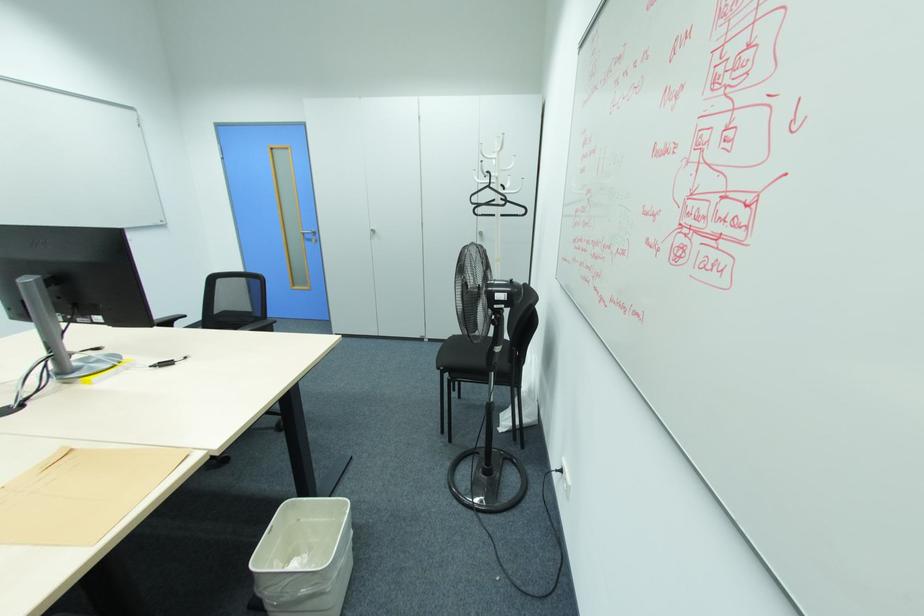
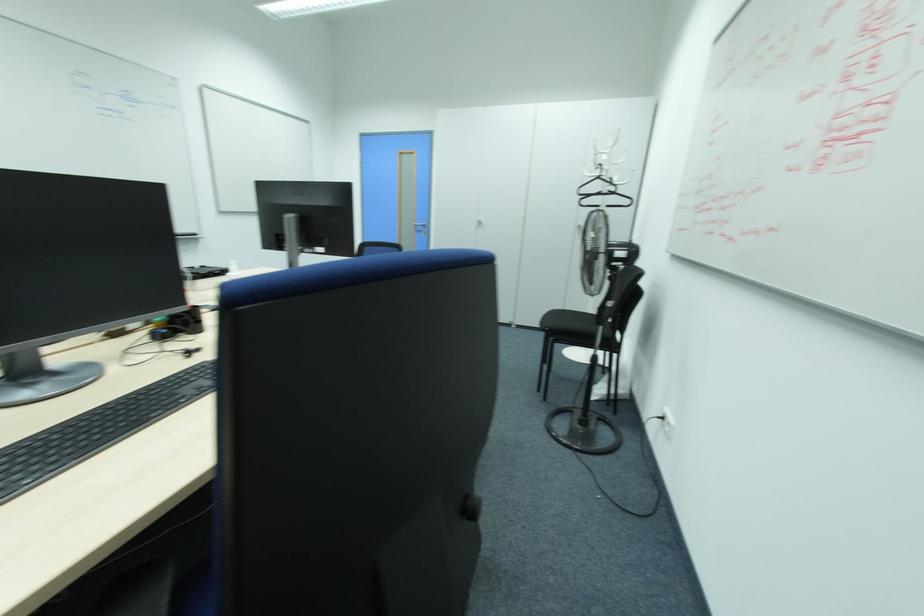
In the second image, find the point that corresponds to pixel 490 187 in the first image.

(599, 177)